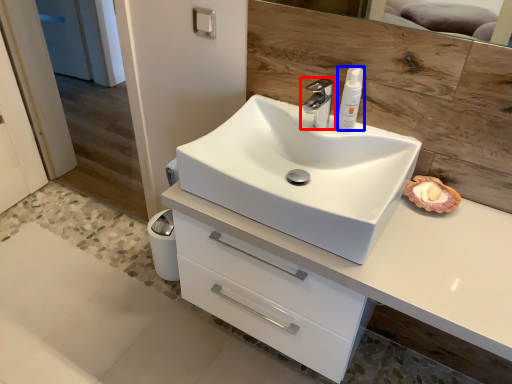
Question: Which object appears farthest to the camera in this image, tap (highlighted by a red box) or toiletry (highlighted by a blue box)?

Choices:
 (A) tap
 (B) toiletry

Answer: (B)